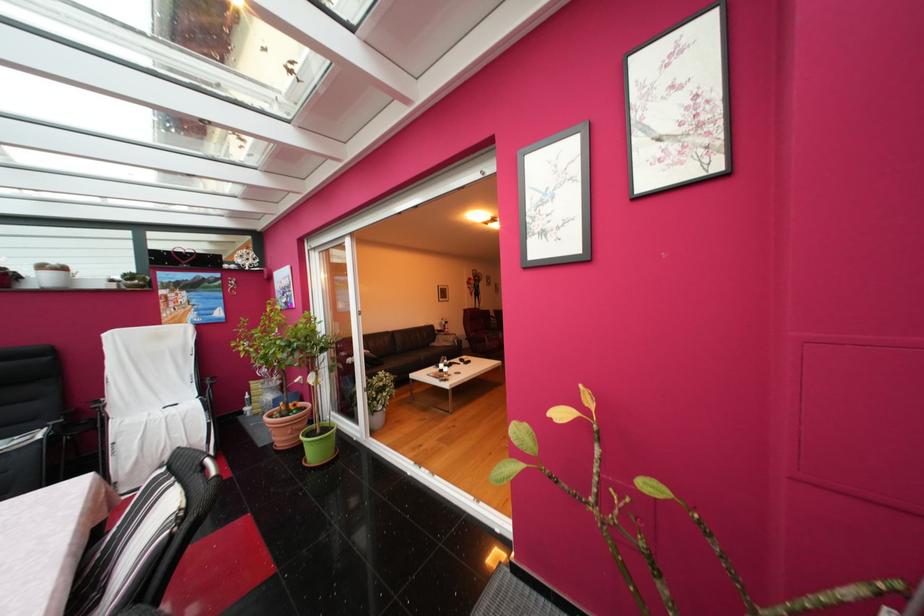
Image resolution: width=924 pixels, height=616 pixels. I want to click on white door frame, so coord(357,337).